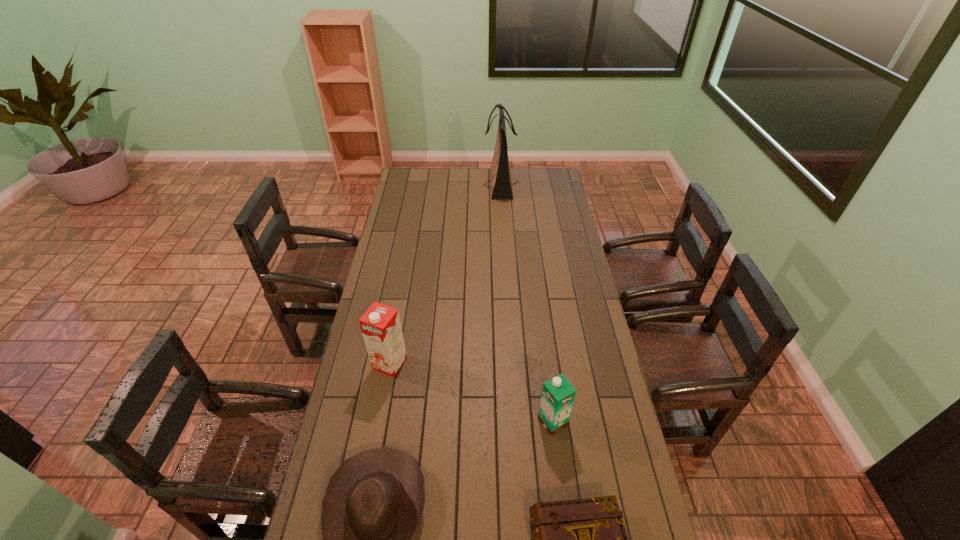
You are a GUI agent. You are given a task and a screenshot of the screen. Output one action in this format:
    pyautogui.click(x=<x>, y=<y>)
    Task: Click on the vacant region located on the back of the shorter carton
    Image resolution: width=960 pixels, height=540 pixels.
    Given the screenshot: What is the action you would take?
    pyautogui.click(x=547, y=377)

The width and height of the screenshot is (960, 540). Identify the location of object present at the far edge. (500, 174).

Find the location of a particular element. The height and width of the screenshot is (540, 960). object positioned at the left edge is located at coordinates (381, 327).

The image size is (960, 540). Identify the location of vacant area at the far edge. (478, 170).

The width and height of the screenshot is (960, 540). Find the location of `vacant space at the left edge of the desktop`. vacant space at the left edge of the desktop is located at coordinates 346,401.

The width and height of the screenshot is (960, 540). In the image, there is a desktop. Find the location of `vacant space at the right edge`. vacant space at the right edge is located at coordinates (552, 226).

Image resolution: width=960 pixels, height=540 pixels. Find the location of `free space between the left carton and the third nearest object`. free space between the left carton and the third nearest object is located at coordinates (471, 393).

You are a GUI agent. You are given a task and a screenshot of the screen. Output one action in this format:
    pyautogui.click(x=<x>, y=<y>)
    Task: Click on the free space between the tallest object and the left carton
    This screenshot has height=540, width=960.
    Given the screenshot: What is the action you would take?
    pyautogui.click(x=444, y=274)

Image resolution: width=960 pixels, height=540 pixels. In order to click on vacant region between the taller carton and the shorter carton in this screenshot , I will do `click(471, 393)`.

The image size is (960, 540). In order to click on free space between the tallest object and the fourth nearest object in this screenshot , I will do `click(444, 274)`.